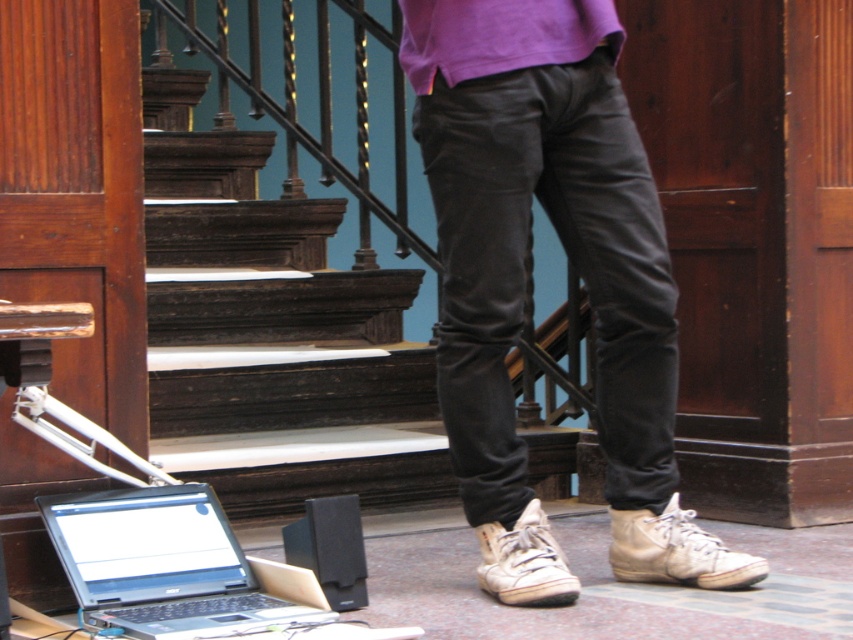
You are a delivery person who needs to place a small package on the surface where the silver metallic laptop at lower left is located. Considering the height of the matte black pants at center, will the package be visible from above the surface?

The matte black pants at center is much taller than the silver metallic laptop at lower left, so the package placed on the surface where the silver metallic laptop at lower left is located might be partially or fully obscured by the matte black pants at center from above.

You are a delivery person who needs to place a small package on the surface where the silver metallic laptop at lower left is located. However, you must avoid stepping on the matte black pants at center. Can you reach the surface without stepping on the pants?

The matte black pants at center is further to the viewer than the silver metallic laptop at lower left, so the pants are closer to you. Therefore, you can reach the surface where the silver metallic laptop at lower left is placed without stepping on the pants as they are closer and you can navigate around them.

You are a person who wants to pick up the purple cotton sweatshirt at center. Can you reach it without moving the dark wood stairs at center?

The purple cotton sweatshirt at center is behind the dark wood stairs at center, so you cannot reach it without moving the dark wood stairs at center.